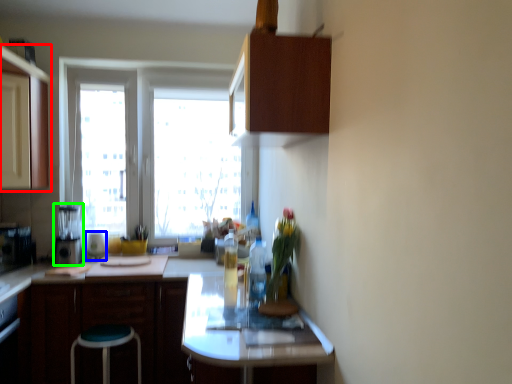
Question: Which object is positioned farthest from cabinetry (highlighted by a red box)? Select from appliance (highlighted by a blue box) and appliance (highlighted by a green box).

Choices:
 (A) appliance
 (B) appliance

Answer: (A)